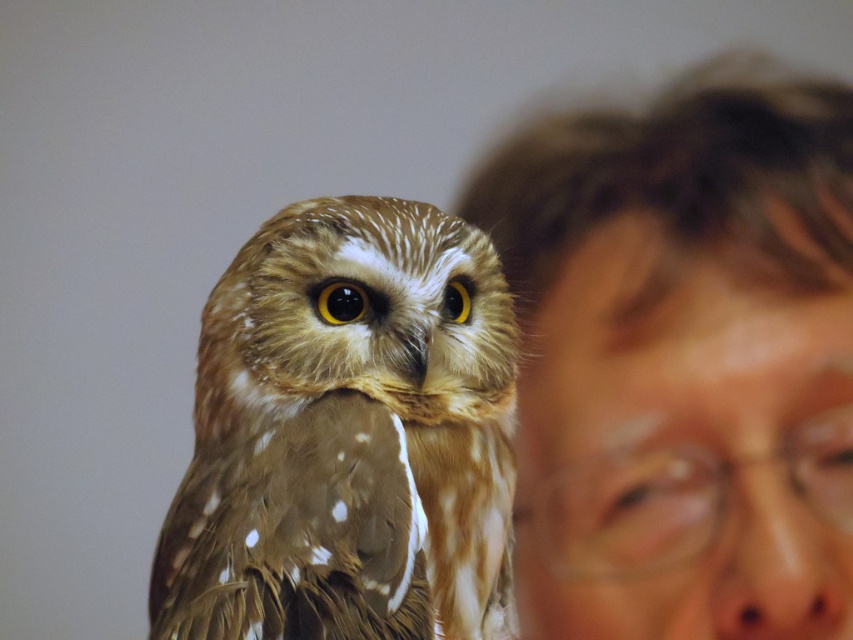
Question: Is smooth skin face at right closer to the viewer compared to brown speckled feathers at center?

Choices:
 (A) yes
 (B) no

Answer: (A)

Question: Can you confirm if smooth skin face at right is wider than brown speckled feathers at center?

Choices:
 (A) yes
 (B) no

Answer: (B)

Question: Is smooth skin face at right to the left of brown speckled feathers at center from the viewer's perspective?

Choices:
 (A) no
 (B) yes

Answer: (A)

Question: Which of the following is the closest to the observer?

Choices:
 (A) smooth skin face at right
 (B) brown speckled feathers at center

Answer: (A)

Question: Which point is closer to the camera?

Choices:
 (A) (761, 538)
 (B) (428, 440)

Answer: (A)

Question: Which object appears closest to the camera in this image?

Choices:
 (A) brown speckled feathers at center
 (B) smooth skin face at right

Answer: (B)